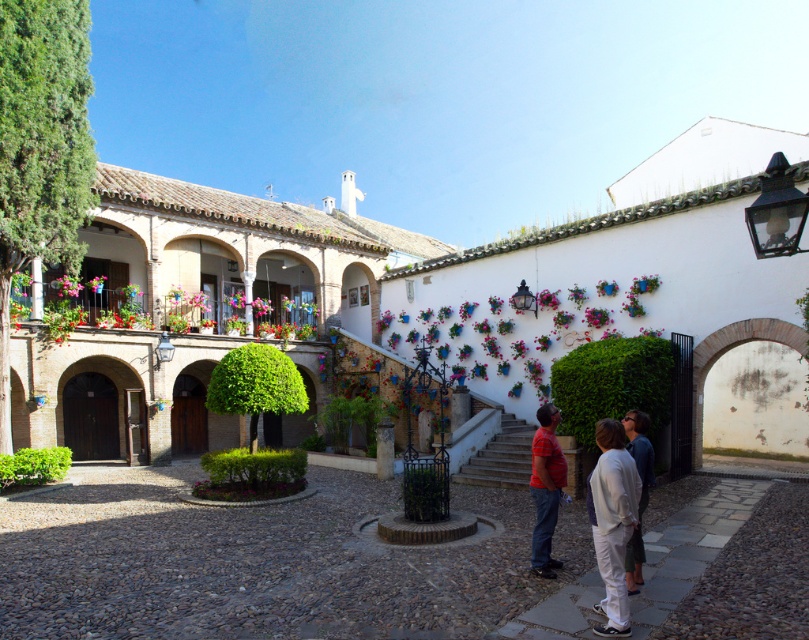
Question: Which of these objects is positioned farthest from the matte red shirt at center?

Choices:
 (A) dark blue shirt at center
 (B) white cotton pants at lower right

Answer: (B)

Question: Does white cotton pants at lower right have a lesser width compared to matte red shirt at center?

Choices:
 (A) yes
 (B) no

Answer: (B)

Question: Does white cotton pants at lower right have a larger size compared to dark blue shirt at center?

Choices:
 (A) no
 (B) yes

Answer: (A)

Question: Which object is positioned farthest from the white cotton pants at lower right?

Choices:
 (A) matte red shirt at center
 (B) dark blue shirt at center

Answer: (A)

Question: Which point appears farthest from the camera in this image?

Choices:
 (A) click(634, 561)
 (B) click(541, 433)

Answer: (B)

Question: Is white cotton pants at lower right below dark blue shirt at center?

Choices:
 (A) yes
 (B) no

Answer: (A)